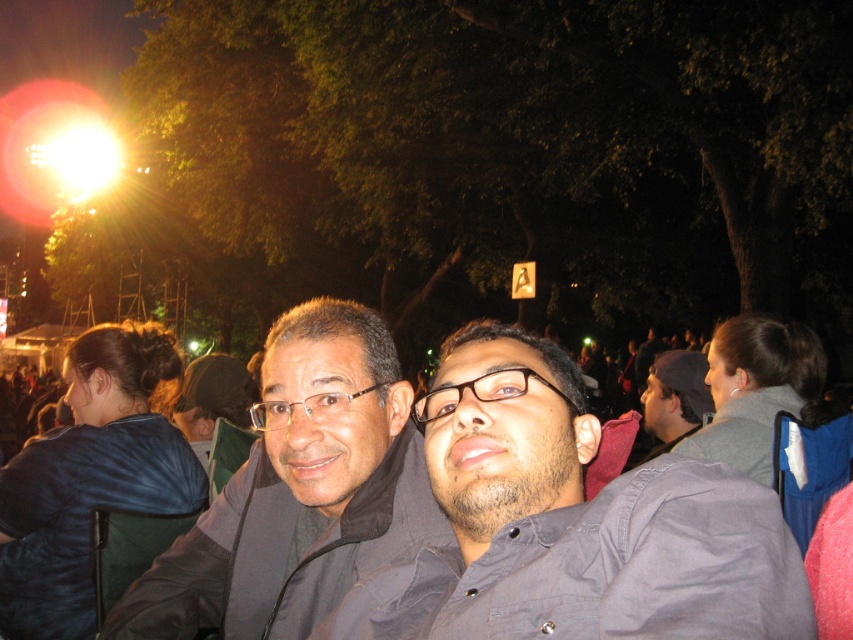
Does matte black jacket at center come in front of blue fabric at center?

Yes, matte black jacket at center is closer to the viewer.

Can you confirm if matte black jacket at center is positioned to the right of blue fabric at center?

Yes, matte black jacket at center is to the right of blue fabric at center.

Which is in front, point (344, 378) or point (27, 608)?

Point (344, 378) is in front.

In order to click on matte black jacket at center in this screenshot , I will do `click(299, 492)`.

Can you confirm if dark gray shirt at center is positioned above blue fabric at center?

Correct, dark gray shirt at center is located above blue fabric at center.

In the scene shown: Between dark gray shirt at center and blue fabric at center, which one has more height?

With more height is blue fabric at center.

Locate an element on the screen. The image size is (853, 640). dark gray shirt at center is located at coordinates (572, 524).

Does dark gray shirt at center have a greater height compared to matte black jacket at center?

No, dark gray shirt at center is not taller than matte black jacket at center.

Does point (572, 488) come closer to viewer compared to point (329, 346)?

Yes.

What do you see at coordinates (572, 524) in the screenshot?
I see `dark gray shirt at center` at bounding box center [572, 524].

You are a GUI agent. You are given a task and a screenshot of the screen. Output one action in this format:
    pyautogui.click(x=<x>, y=<y>)
    Task: Click on the dark gray shirt at center
    This screenshot has width=853, height=640.
    Given the screenshot: What is the action you would take?
    pyautogui.click(x=572, y=524)